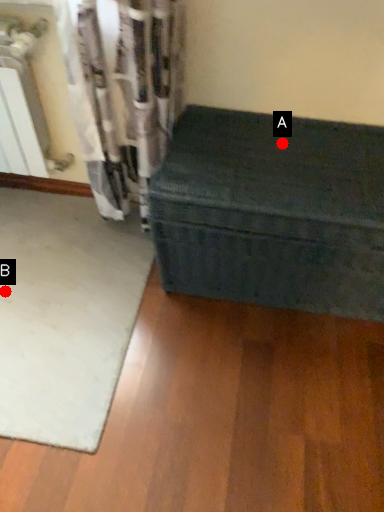
Question: Two points are circled on the image, labeled by A and B beside each circle. Which point is further to the camera?

Choices:
 (A) A is further
 (B) B is further

Answer: (B)